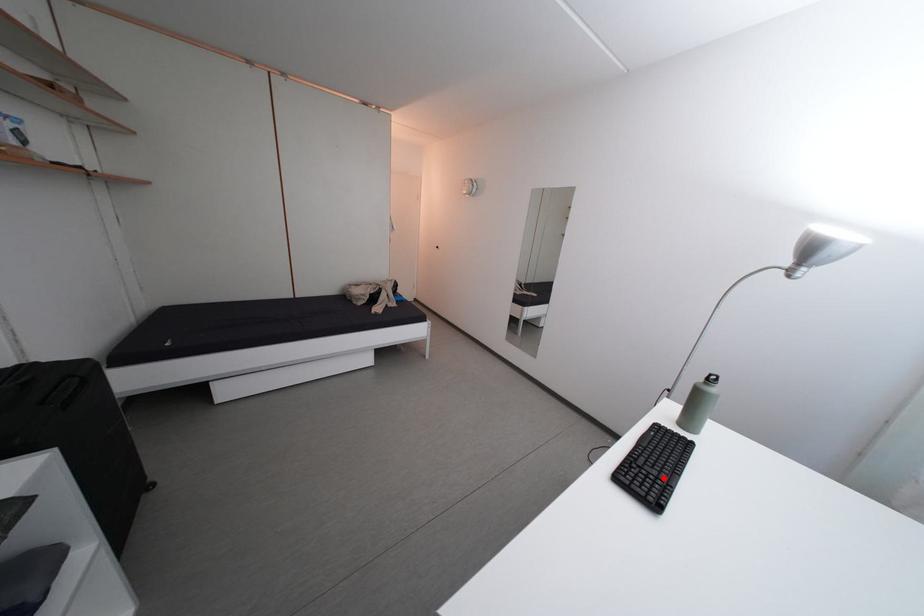
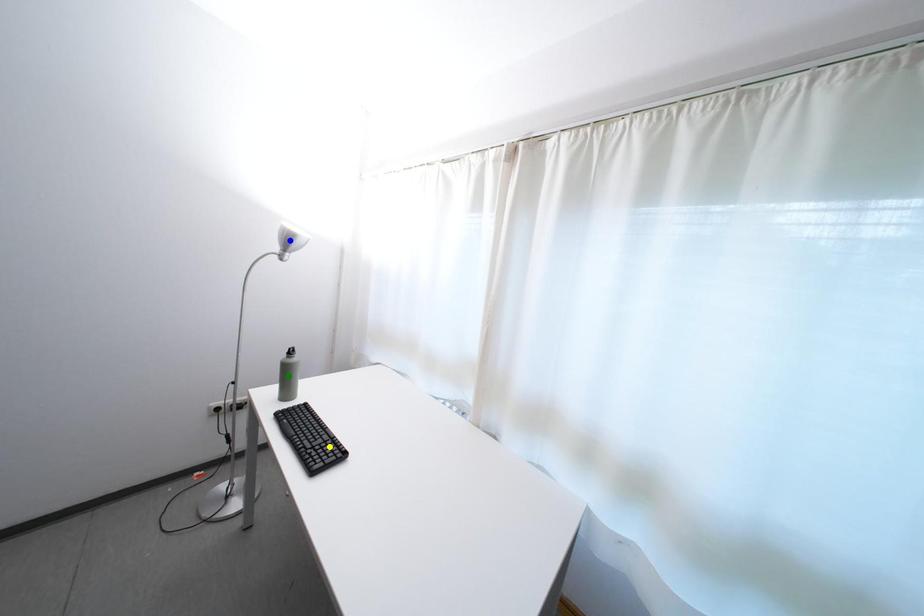
Question: I am providing you with two images of the same scene from different viewpoints. A red point is marked on the first image. You are given multiple points on the second image. Can you choose the point in image 2 that corresponds to the point in image 1?

Choices:
 (A) blue point
 (B) green point
 (C) yellow point

Answer: (C)